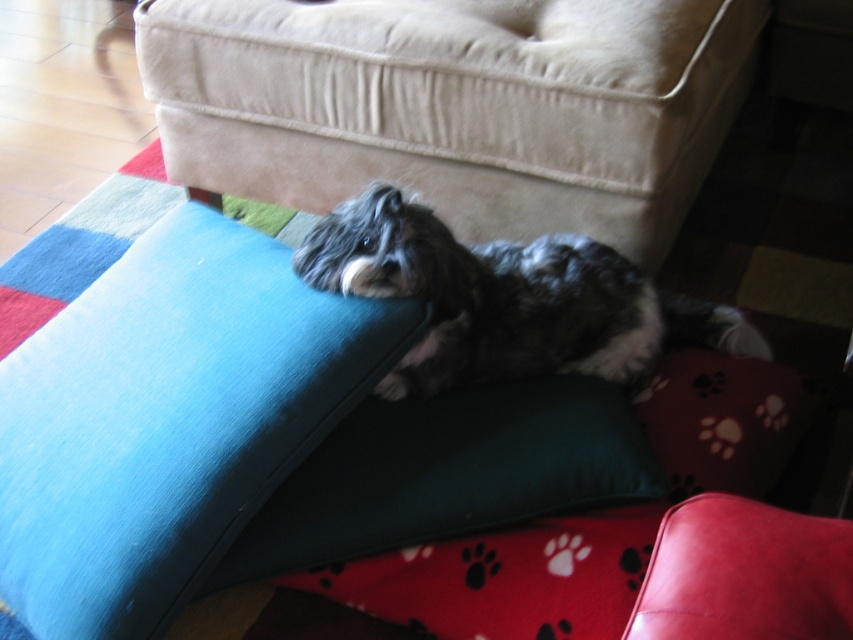
Does dark green fabric pillow at center have a smaller size compared to fluffy gray dog at center?

Correct, dark green fabric pillow at center occupies less space than fluffy gray dog at center.

What do you see at coordinates (445, 474) in the screenshot? This screenshot has height=640, width=853. I see `dark green fabric pillow at center` at bounding box center [445, 474].

Does point (471, 420) lie in front of point (350, 266)?

That is False.

Where is `dark green fabric pillow at center`? This screenshot has height=640, width=853. dark green fabric pillow at center is located at coordinates (445, 474).

Is point (258, 256) behind point (701, 337)?

No.

Looking at this image, which of these two, teal fabric cushion at upper left or fluffy gray dog at center, stands shorter?

Standing shorter between the two is fluffy gray dog at center.

Where is `teal fabric cushion at upper left`? Image resolution: width=853 pixels, height=640 pixels. teal fabric cushion at upper left is located at coordinates (167, 419).

Locate an element on the screen. teal fabric cushion at upper left is located at coordinates (167, 419).

Can you confirm if shaggy fur dog at center is positioned to the right of teal fabric cushion at upper left?

Correct, you'll find shaggy fur dog at center to the right of teal fabric cushion at upper left.

Can you confirm if shaggy fur dog at center is wider than teal fabric cushion at upper left?

Correct, the width of shaggy fur dog at center exceeds that of teal fabric cushion at upper left.

Locate an element on the screen. The image size is (853, 640). shaggy fur dog at center is located at coordinates (456, 106).